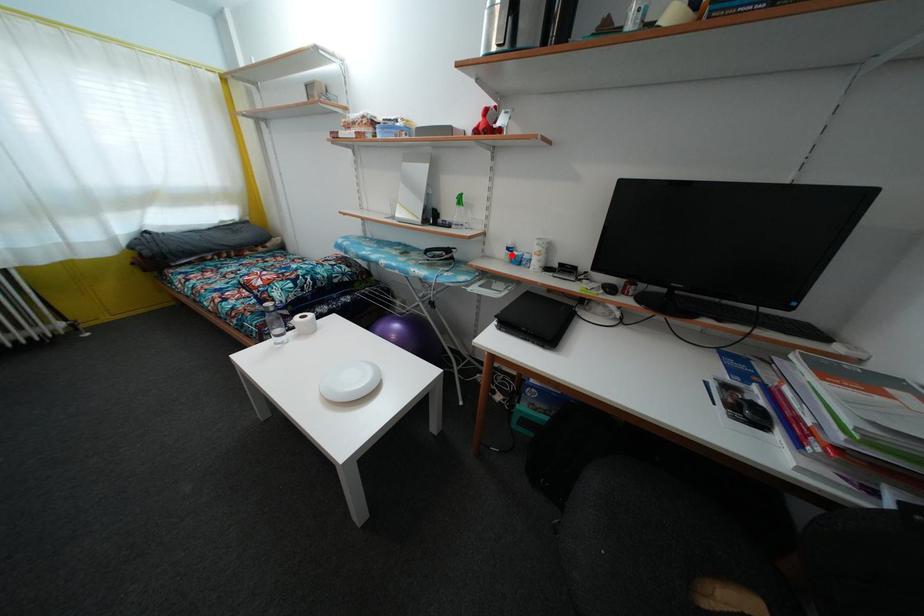
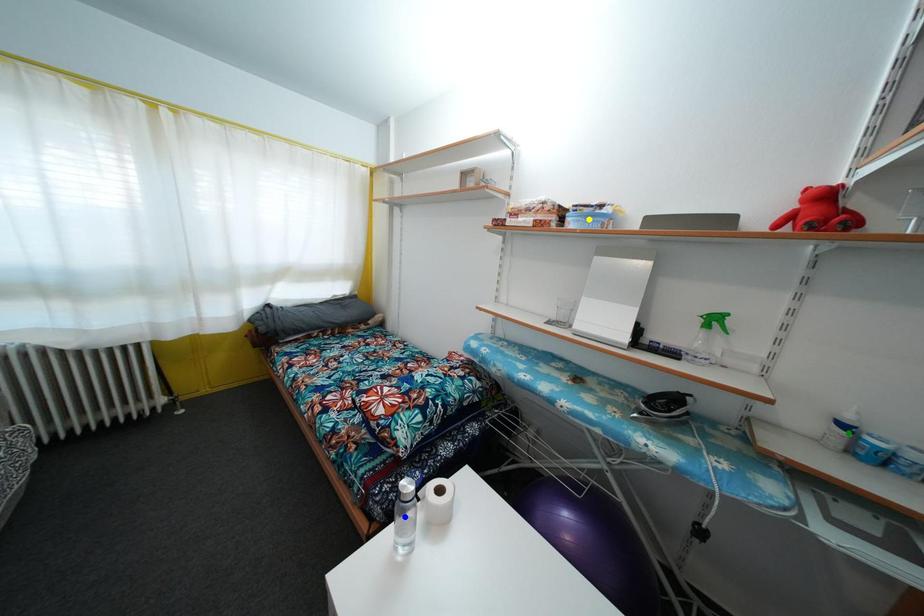
Question: I am providing you with two images of the same scene from different viewpoints. A red point is marked on the first image. You are given multiple points on the second image. In image 2, which mark is for the same physical point as the one in image 1?

Choices:
 (A) blue point
 (B) green point
 (C) yellow point

Answer: (B)